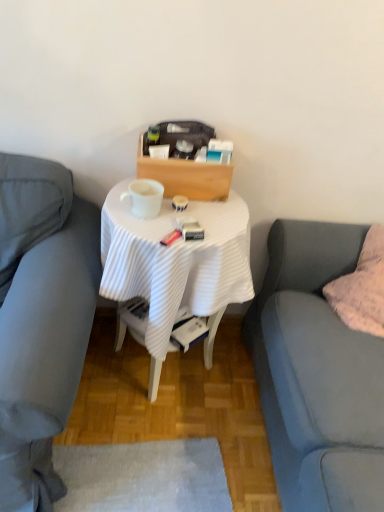
Question: Does matte gray couch at left, placed as the 1th studio couch when sorted from left to right, have a larger size compared to white glossy mug at center?

Choices:
 (A) yes
 (B) no

Answer: (A)

Question: Can you confirm if matte gray couch at left, the second studio couch viewed from the right, is taller than white glossy mug at center?

Choices:
 (A) yes
 (B) no

Answer: (A)

Question: Is matte gray couch at left, the second studio couch viewed from the right, facing towards white glossy mug at center?

Choices:
 (A) yes
 (B) no

Answer: (B)

Question: Is matte gray couch at left, placed as the 1th studio couch when sorted from left to right, shorter than white glossy mug at center?

Choices:
 (A) yes
 (B) no

Answer: (B)

Question: Does matte gray couch at left, the second studio couch viewed from the right, come in front of white glossy mug at center?

Choices:
 (A) yes
 (B) no

Answer: (A)

Question: From the image's perspective, is white glossy mug at center positioned above or below soft gray fabric couch at right, marked as the first studio couch in a right-to-left arrangement?

Choices:
 (A) below
 (B) above

Answer: (B)

Question: Looking at their shapes, would you say white glossy mug at center is wider or thinner than soft gray fabric couch at right, marked as the first studio couch in a right-to-left arrangement?

Choices:
 (A) thin
 (B) wide

Answer: (A)

Question: In the image, is white glossy mug at center on the left side or the right side of soft gray fabric couch at right, the second studio couch in the left-to-right sequence?

Choices:
 (A) left
 (B) right

Answer: (A)

Question: Is white glossy mug at center taller or shorter than soft gray fabric couch at right, marked as the first studio couch in a right-to-left arrangement?

Choices:
 (A) tall
 (B) short

Answer: (B)

Question: Is white glossy mug at center in front of or behind white ribbed cloth at center in the image?

Choices:
 (A) behind
 (B) front

Answer: (A)

Question: Would you say white glossy mug at center is inside or outside white ribbed cloth at center?

Choices:
 (A) inside
 (B) outside

Answer: (B)

Question: Looking at their shapes, would you say white glossy mug at center is wider or thinner than white ribbed cloth at center?

Choices:
 (A) thin
 (B) wide

Answer: (A)

Question: From a real-world perspective, is white glossy mug at center above or below white ribbed cloth at center?

Choices:
 (A) below
 (B) above

Answer: (B)

Question: Which is correct: white ribbed cloth at center is inside matte gray couch at left, placed as the 1th studio couch when sorted from left to right, or outside of it?

Choices:
 (A) outside
 (B) inside

Answer: (A)

Question: Is white ribbed cloth at center bigger or smaller than matte gray couch at left, the second studio couch viewed from the right?

Choices:
 (A) small
 (B) big

Answer: (A)